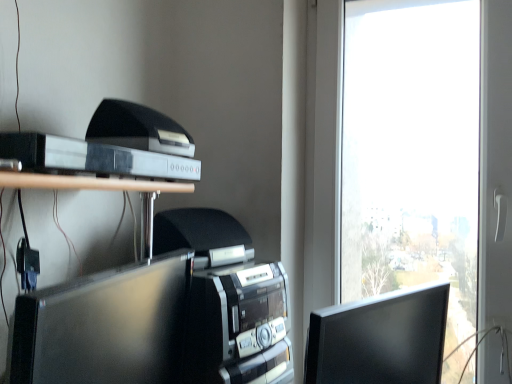
Measure the distance between matte black monitor at right, the first computer monitor positioned from the right, and camera.

matte black monitor at right, the first computer monitor positioned from the right, and camera are 29.89 inches apart.

Image resolution: width=512 pixels, height=384 pixels. Identify the location of matte black monitor at right, the first computer monitor positioned from the right. (380, 339).

The image size is (512, 384). What do you see at coordinates (104, 326) in the screenshot? I see `matte black monitor at center, marked as the second computer monitor in a right-to-left arrangement` at bounding box center [104, 326].

Identify the location of matte black monitor at right, which is the 2th computer monitor from left to right. (380, 339).

Is matte black monitor at right, which is the 2th computer monitor from left to right, at the back of black plastic printer at upper left?

No, black plastic printer at upper left's orientation is not away from matte black monitor at right, which is the 2th computer monitor from left to right.

Considering the sizes of objects black plastic printer at upper left and matte black monitor at right, which is the 2th computer monitor from left to right, in the image provided, who is smaller, black plastic printer at upper left or matte black monitor at right, which is the 2th computer monitor from left to right,?

Smaller between the two is black plastic printer at upper left.

In terms of width, does black plastic printer at upper left look wider or thinner when compared to matte black monitor at right, the first computer monitor positioned from the right?

black plastic printer at upper left is thinner than matte black monitor at right, the first computer monitor positioned from the right.

Is black plastic printer at upper left far away from matte black monitor at right, which is the 2th computer monitor from left to right?

They are positioned close to each other.

From a real-world perspective, is matte black monitor at right, which is the 2th computer monitor from left to right, positioned under black plastic printer at upper left based on gravity?

Indeed, from a real-world perspective, matte black monitor at right, which is the 2th computer monitor from left to right, is positioned beneath black plastic printer at upper left.

Can you confirm if matte black monitor at right, which is the 2th computer monitor from left to right, is taller than black plastic printer at upper left?

Yes, matte black monitor at right, which is the 2th computer monitor from left to right, is taller than black plastic printer at upper left.

Is matte black monitor at right, which is the 2th computer monitor from left to right, far away from black plastic printer at upper left?

matte black monitor at right, which is the 2th computer monitor from left to right, is actually quite close to black plastic printer at upper left.

Is matte black monitor at right, the first computer monitor positioned from the right, positioned behind black plastic printer at upper left?

No.

From a real-world perspective, who is located higher, matte black monitor at center, which appears as the first computer monitor when viewed from the left, or black plastic printer at upper left?

black plastic printer at upper left.

In the image, there is a matte black monitor at center, which appears as the first computer monitor when viewed from the left. Where is `printer above it (from the image's perspective)`? The width and height of the screenshot is (512, 384). printer above it (from the image's perspective) is located at coordinates (145, 137).

Considering the points (177, 353) and (167, 124), which point is behind, point (177, 353) or point (167, 124)?

Positioned behind is point (177, 353).

Could you measure the distance between matte black monitor at center, marked as the second computer monitor in a right-to-left arrangement, and black plastic printer at upper left?

A distance of 25.41 centimeters exists between matte black monitor at center, marked as the second computer monitor in a right-to-left arrangement, and black plastic printer at upper left.

Would you say matte black monitor at center, which appears as the first computer monitor when viewed from the left, is part of matte black monitor at right, the first computer monitor positioned from the right,'s contents?

No, matte black monitor at center, which appears as the first computer monitor when viewed from the left, is not surrounded by matte black monitor at right, the first computer monitor positioned from the right.

Which point is more forward, [323,361] or [151,293]?

The point [151,293] is in front.

Can you confirm if matte black monitor at right, the first computer monitor positioned from the right, is bigger than matte black monitor at center, marked as the second computer monitor in a right-to-left arrangement?

No, matte black monitor at right, the first computer monitor positioned from the right, is not bigger than matte black monitor at center, marked as the second computer monitor in a right-to-left arrangement.

From a real-world perspective, which is physically below, matte black monitor at right, which is the 2th computer monitor from left to right, or matte black monitor at center, marked as the second computer monitor in a right-to-left arrangement?

From a 3D spatial view, matte black monitor at right, which is the 2th computer monitor from left to right, is below.

Which is farther, [159,129] or [98,377]?

The point [159,129] is more distant.

From a real-world perspective, who is located lower, black plastic printer at upper left or matte black monitor at center, marked as the second computer monitor in a right-to-left arrangement?

From a 3D spatial view, matte black monitor at center, marked as the second computer monitor in a right-to-left arrangement, is below.

From the picture: Is black plastic printer at upper left aimed at matte black monitor at center, marked as the second computer monitor in a right-to-left arrangement?

No, black plastic printer at upper left does not turn towards matte black monitor at center, marked as the second computer monitor in a right-to-left arrangement.

Based on the photo, from the image's perspective, between black plastic printer at upper left and matte black monitor at center, which appears as the first computer monitor when viewed from the left, which one is located above?

From the image's view, black plastic printer at upper left is above.

Is matte black monitor at center, marked as the second computer monitor in a right-to-left arrangement, in contact with matte black monitor at right, which is the 2th computer monitor from left to right?

They are not placed beside each other.

Which object is thinner, matte black monitor at center, marked as the second computer monitor in a right-to-left arrangement, or matte black monitor at right, the first computer monitor positioned from the right?

With smaller width is matte black monitor at right, the first computer monitor positioned from the right.

Is matte black monitor at center, marked as the second computer monitor in a right-to-left arrangement, bigger or smaller than matte black monitor at right, which is the 2th computer monitor from left to right?

Clearly, matte black monitor at center, marked as the second computer monitor in a right-to-left arrangement, is larger in size than matte black monitor at right, which is the 2th computer monitor from left to right.

Find the location of a particular element. computer monitor on the left of matte black monitor at right, which is the 2th computer monitor from left to right is located at coordinates (104, 326).

This screenshot has width=512, height=384. What are the coordinates of `the 2nd computer monitor positioned below the black plastic printer at upper left (from a real-world perspective)` in the screenshot? It's located at (380, 339).

Identify the location of printer behind the matte black monitor at right, the first computer monitor positioned from the right. The image size is (512, 384). (145, 137).

Based on the photo, based on their spatial positions, is matte black monitor at right, which is the 2th computer monitor from left to right, or matte black monitor at center, which appears as the first computer monitor when viewed from the left, closer to black plastic printer at upper left?

matte black monitor at center, which appears as the first computer monitor when viewed from the left, is positioned closer to the anchor black plastic printer at upper left.

Considering their positions, is matte black monitor at center, marked as the second computer monitor in a right-to-left arrangement, positioned closer to matte black monitor at right, the first computer monitor positioned from the right, than black plastic printer at upper left?

The object closer to matte black monitor at right, the first computer monitor positioned from the right, is matte black monitor at center, marked as the second computer monitor in a right-to-left arrangement.

From the image, which object appears to be farther from matte black monitor at right, which is the 2th computer monitor from left to right, black plastic printer at upper left or matte black monitor at center, which appears as the first computer monitor when viewed from the left?

black plastic printer at upper left.

Considering their positions, is matte black monitor at center, marked as the second computer monitor in a right-to-left arrangement, positioned closer to black plastic printer at upper left than matte black monitor at right, which is the 2th computer monitor from left to right?

Based on the image, matte black monitor at center, marked as the second computer monitor in a right-to-left arrangement, appears to be nearer to black plastic printer at upper left.

Considering their positions, is matte black monitor at right, the first computer monitor positioned from the right, positioned further to matte black monitor at center, which appears as the first computer monitor when viewed from the left, than black plastic printer at upper left?

matte black monitor at right, the first computer monitor positioned from the right.

Which object lies further to the anchor point matte black monitor at center, which appears as the first computer monitor when viewed from the left, black plastic printer at upper left or matte black monitor at right, the first computer monitor positioned from the right?

Among the two, matte black monitor at right, the first computer monitor positioned from the right, is located further to matte black monitor at center, which appears as the first computer monitor when viewed from the left.

Image resolution: width=512 pixels, height=384 pixels. I want to click on computer monitor between black plastic printer at upper left and matte black monitor at right, the first computer monitor positioned from the right, in the horizontal direction, so 104,326.